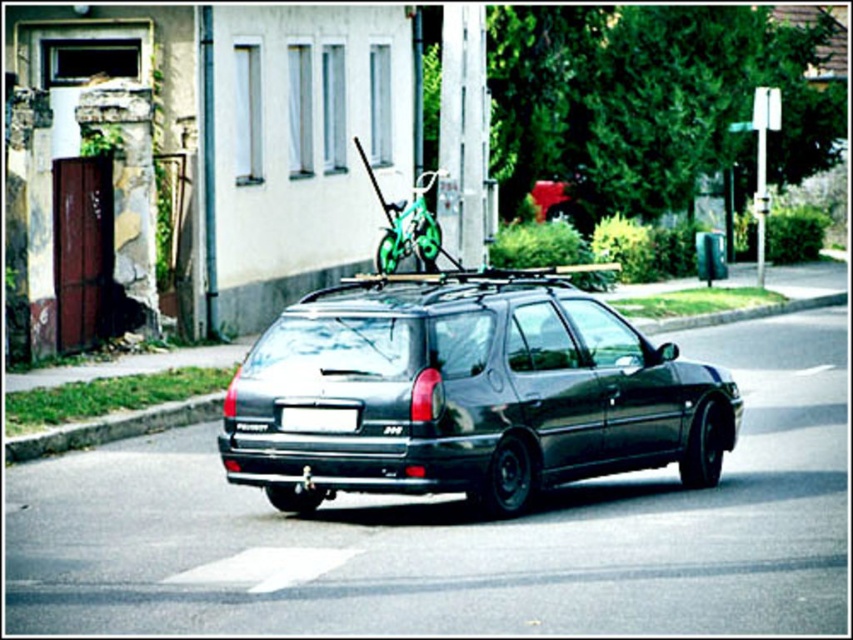
Question: Based on their relative distances, which object is nearer to the green grass at lower left?

Choices:
 (A) shiny black car at center
 (B) green matte bicycle at center
 (C) white plastic license plate at rear

Answer: (C)

Question: Which object is closer to the camera taking this photo?

Choices:
 (A) green matte bicycle at center
 (B) shiny black car at center

Answer: (B)

Question: From the image, what is the correct spatial relationship of shiny black car at center in relation to white plastic license plate at rear?

Choices:
 (A) below
 (B) above

Answer: (A)

Question: Is green matte bicycle at center further to camera compared to white plastic license plate at rear?

Choices:
 (A) no
 (B) yes

Answer: (B)

Question: Which object appears closest to the camera in this image?

Choices:
 (A) green matte bicycle at center
 (B) white plastic license plate at rear
 (C) shiny black car at center
 (D) green grass at lower left

Answer: (B)

Question: Does green grass at lower left lie behind green matte bicycle at center?

Choices:
 (A) yes
 (B) no

Answer: (B)